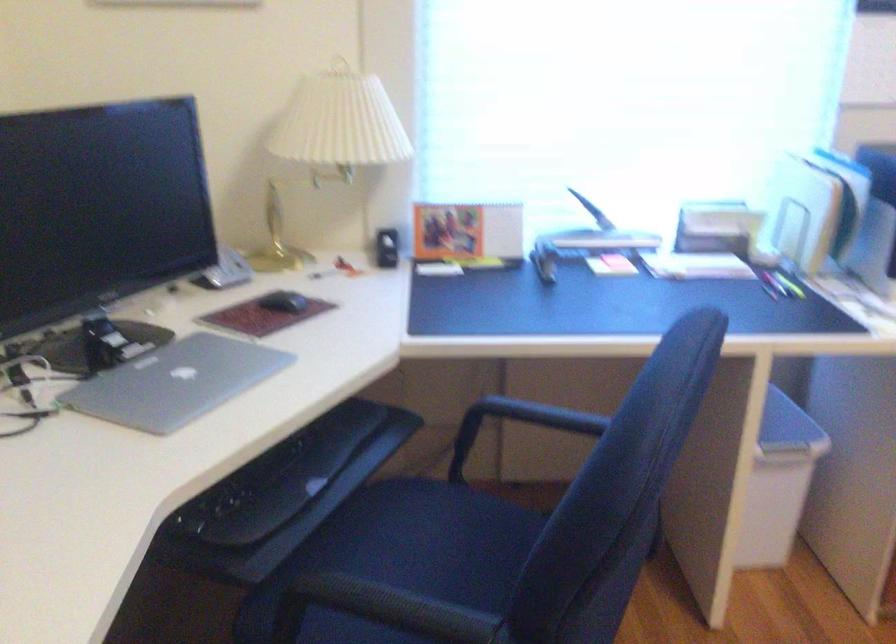
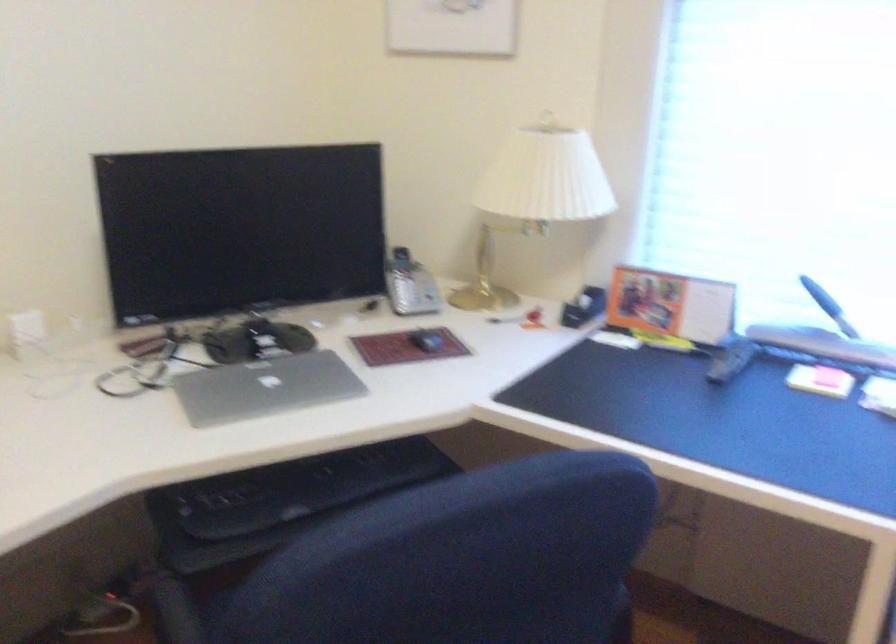
Locate, in the second image, the point that corresponds to pixel 185 383 in the first image.

(264, 386)